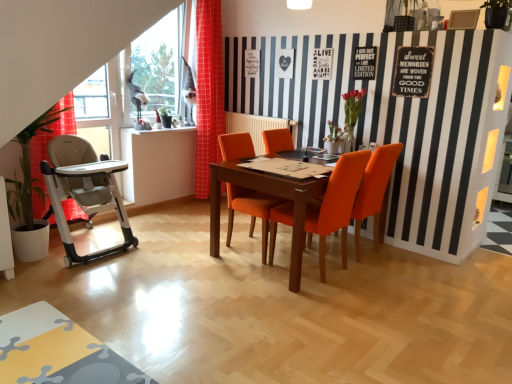
Question: From a real-world perspective, is orange fabric chair at center, the 3th chair positioned from the left, located higher than green leafy plant at left?

Choices:
 (A) yes
 (B) no

Answer: (B)

Question: Is orange fabric chair at center, the 3th chair positioned from the left, not inside green leafy plant at left?

Choices:
 (A) yes
 (B) no

Answer: (A)

Question: Does orange fabric chair at center, which ranks as the first chair in right-to-left order, have a larger size compared to green leafy plant at left?

Choices:
 (A) no
 (B) yes

Answer: (A)

Question: From the image's perspective, would you say orange fabric chair at center, which ranks as the first chair in right-to-left order, is positioned over green leafy plant at left?

Choices:
 (A) yes
 (B) no

Answer: (B)

Question: From the image's perspective, is orange fabric chair at center, which ranks as the first chair in right-to-left order, beneath green leafy plant at left?

Choices:
 (A) no
 (B) yes

Answer: (B)

Question: Is red checkered curtain at left situated inside orange fabric chair at center, the first chair in the left-to-right sequence, or outside?

Choices:
 (A) outside
 (B) inside

Answer: (A)

Question: In the image, is red checkered curtain at left positioned in front of or behind orange fabric chair at center, the 3th chair positioned from the right?

Choices:
 (A) behind
 (B) front

Answer: (A)

Question: Is point (215, 112) closer or farther from the camera than point (221, 139)?

Choices:
 (A) farther
 (B) closer

Answer: (A)

Question: Would you say red checkered curtain at left is to the left or to the right of orange fabric chair at center, the first chair in the left-to-right sequence, in the picture?

Choices:
 (A) right
 (B) left

Answer: (B)

Question: From the image's perspective, is green leafy plant at left above or below red checkered curtain at left?

Choices:
 (A) above
 (B) below

Answer: (B)

Question: From a real-world perspective, relative to red checkered curtain at left, is green leafy plant at left vertically above or below?

Choices:
 (A) above
 (B) below

Answer: (B)

Question: In terms of height, does green leafy plant at left look taller or shorter compared to red checkered curtain at left?

Choices:
 (A) short
 (B) tall

Answer: (A)

Question: Based on their positions, is green leafy plant at left located to the left or right of red checkered curtain at left?

Choices:
 (A) left
 (B) right

Answer: (A)

Question: Considering their positions, is orange fabric chair at center, the 3th chair positioned from the left, located in front of or behind orange fabric chair at center, which ranks as the 2th chair in right-to-left order?

Choices:
 (A) behind
 (B) front

Answer: (A)

Question: Choose the correct answer: Is orange fabric chair at center, the 3th chair positioned from the left, inside orange fabric chair at center, the second chair viewed from the left, or outside it?

Choices:
 (A) outside
 (B) inside

Answer: (A)